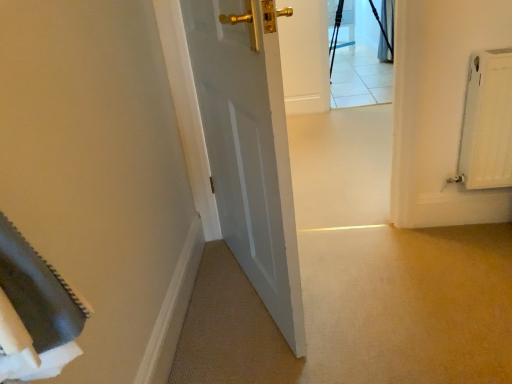
Question: Is matte black chair at upper center positioned with its back to black fabric curtain at upper right?

Choices:
 (A) yes
 (B) no

Answer: (B)

Question: Is matte black chair at upper center not close to black fabric curtain at upper right?

Choices:
 (A) no
 (B) yes

Answer: (B)

Question: Considering the relative sizes of matte black chair at upper center and black fabric curtain at upper right in the image provided, is matte black chair at upper center smaller than black fabric curtain at upper right?

Choices:
 (A) no
 (B) yes

Answer: (A)

Question: From the image's perspective, does matte black chair at upper center appear higher than black fabric curtain at upper right?

Choices:
 (A) no
 (B) yes

Answer: (B)

Question: Is matte black chair at upper center oriented towards black fabric curtain at upper right?

Choices:
 (A) no
 (B) yes

Answer: (A)

Question: From the image's perspective, is matte black chair at upper center below black fabric curtain at upper right?

Choices:
 (A) no
 (B) yes

Answer: (A)

Question: Would you say matte black chair at upper center is part of black fabric curtain at upper right's contents?

Choices:
 (A) no
 (B) yes

Answer: (A)

Question: From the image's perspective, is black fabric curtain at upper right located above matte black chair at upper center?

Choices:
 (A) no
 (B) yes

Answer: (A)

Question: Is black fabric curtain at upper right closer to camera compared to matte black chair at upper center?

Choices:
 (A) no
 (B) yes

Answer: (B)

Question: Can you confirm if black fabric curtain at upper right is thinner than matte black chair at upper center?

Choices:
 (A) no
 (B) yes

Answer: (B)

Question: Is black fabric curtain at upper right wider than matte black chair at upper center?

Choices:
 (A) yes
 (B) no

Answer: (B)

Question: Is black fabric curtain at upper right outside matte black chair at upper center?

Choices:
 (A) no
 (B) yes

Answer: (B)

Question: Considering the positions of black fabric curtain at upper right and matte black chair at upper center in the image, is black fabric curtain at upper right taller or shorter than matte black chair at upper center?

Choices:
 (A) short
 (B) tall

Answer: (B)